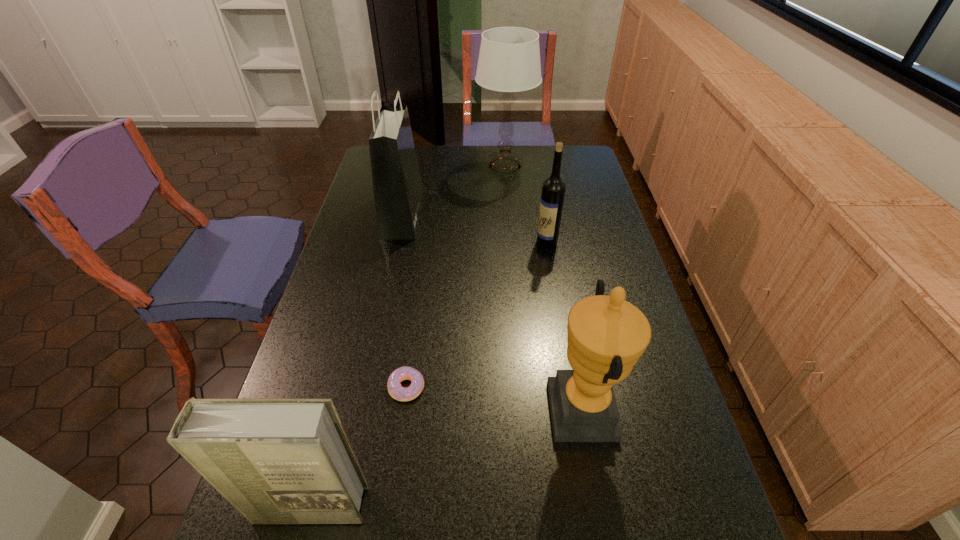
Locate an element on the screen. The height and width of the screenshot is (540, 960). free point between the wine bottle and the phonebook is located at coordinates (428, 374).

I want to click on blank region between the wine bottle and the doughnut, so click(476, 315).

The image size is (960, 540). Identify the location of free space between the shopping bag and the nearest object. (356, 360).

Image resolution: width=960 pixels, height=540 pixels. What are the coordinates of `empty location between the award and the shopping bag` in the screenshot? It's located at (492, 312).

Where is `object that can be found as the closest to the doughnut`? The image size is (960, 540). object that can be found as the closest to the doughnut is located at coordinates (288, 460).

This screenshot has width=960, height=540. I want to click on object that can be found as the fourth closest to the phonebook, so click(553, 189).

You are a GUI agent. You are given a task and a screenshot of the screen. Output one action in this format:
    pyautogui.click(x=<x>, y=<y>)
    Task: Click on the free spot that satisfies the following two spatial constraints: 1. on the label of the wine bottle; 2. on the front side of the doughnut
    
    Given the screenshot: What is the action you would take?
    [x=571, y=387]

You are a GUI agent. You are given a task and a screenshot of the screen. Output one action in this format:
    pyautogui.click(x=<x>, y=<y>)
    Task: Click on the free point that satisfies the following two spatial constraints: 1. on the front with handles of the doughnut; 2. on the left side of the shopping bag
    The image size is (960, 540).
    Given the screenshot: What is the action you would take?
    pyautogui.click(x=366, y=387)

The width and height of the screenshot is (960, 540). What are the coordinates of `vacant area in the image that satisfies the following two spatial constraints: 1. on the back side of the shortest object; 2. on the front with handles of the shopping bag` in the screenshot? It's located at (430, 214).

Locate an element on the screen. This screenshot has width=960, height=540. vacant region that satisfies the following two spatial constraints: 1. on the front with handles of the shopping bag; 2. on the cover of the nearest object is located at coordinates (340, 505).